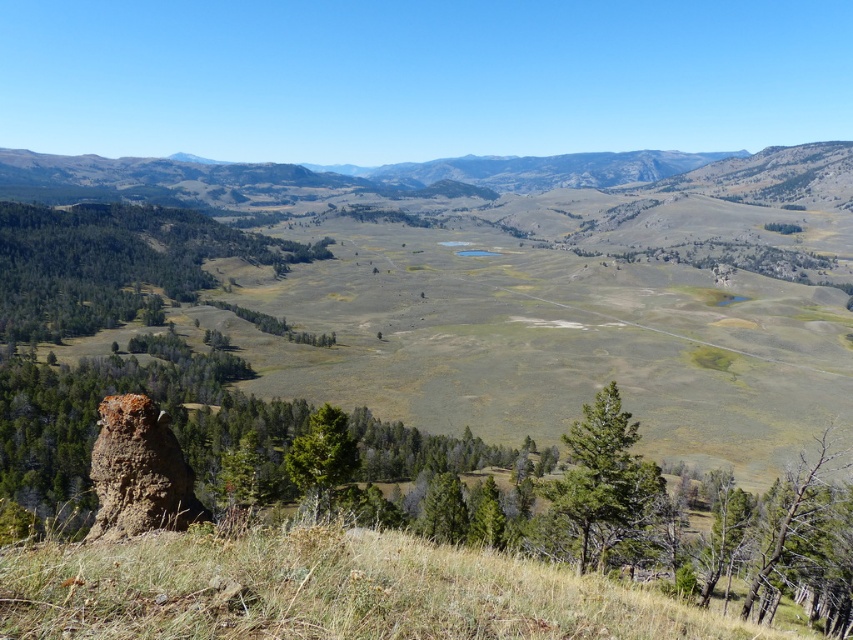
Describe the element at coordinates (325, 589) in the screenshot. This screenshot has height=640, width=853. I see `dry grass at lower left` at that location.

Is point (195, 566) positioned in front of point (122, 461)?

That is True.

Is point (442, 636) less distant than point (167, 513)?

That is True.

I want to click on dry grass at lower left, so click(325, 589).